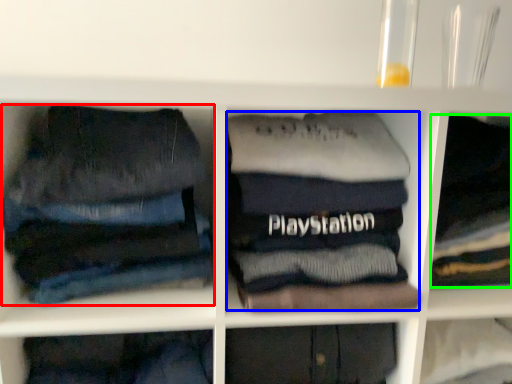
Question: Based on their relative distances, which object is nearer to trousers (highlighted by a red box)? Choose from clothing (highlighted by a blue box) and clothing (highlighted by a green box).

Choices:
 (A) clothing
 (B) clothing

Answer: (A)